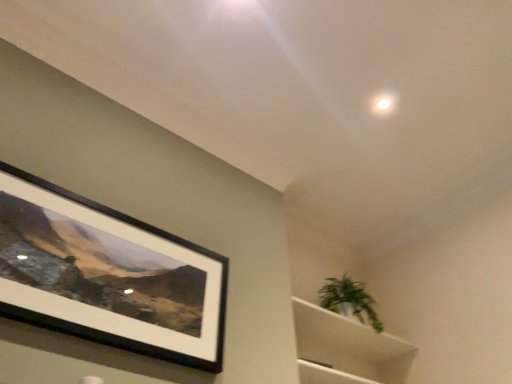
The height and width of the screenshot is (384, 512). What do you see at coordinates (346, 349) in the screenshot?
I see `white matte cabinet at lower right` at bounding box center [346, 349].

What is the approximate height of black matte picture frame at upper left?

The height of black matte picture frame at upper left is 20.05 inches.

What do you see at coordinates (106, 275) in the screenshot? Image resolution: width=512 pixels, height=384 pixels. I see `black matte picture frame at upper left` at bounding box center [106, 275].

Where is `green leafy plant at upper right`? This screenshot has height=384, width=512. green leafy plant at upper right is located at coordinates (349, 300).

From the image's perspective, which is above, green leafy plant at upper right or black matte picture frame at upper left?

From the image's view, black matte picture frame at upper left is above.

Between green leafy plant at upper right and black matte picture frame at upper left, which one has larger width?

green leafy plant at upper right is wider.

Find the location of a particular element. The image size is (512, 384). picture frame lying above the green leafy plant at upper right (from the image's perspective) is located at coordinates (106, 275).

Based on the photo, in terms of height, does black matte picture frame at upper left look taller or shorter compared to green leafy plant at upper right?

Considering their sizes, black matte picture frame at upper left has more height than green leafy plant at upper right.

Which point is more forward, (222, 287) or (354, 298)?

The point (222, 287) is closer.

From the image's perspective, who appears lower, black matte picture frame at upper left or green leafy plant at upper right?

green leafy plant at upper right is shown below in the image.

In the scene shown: Is black matte picture frame at upper left further to the viewer compared to green leafy plant at upper right?

No, the depth of black matte picture frame at upper left is less than that of green leafy plant at upper right.

From a real-world perspective, which is physically below, white matte cabinet at lower right or green leafy plant at upper right?

white matte cabinet at lower right is physically lower.

Is white matte cabinet at lower right not within green leafy plant at upper right?

Yes, white matte cabinet at lower right is located beyond the bounds of green leafy plant at upper right.

What's the angular difference between white matte cabinet at lower right and green leafy plant at upper right's facing directions?

They differ by 1.41 degrees in their facing directions.

Which object is thinner, white matte cabinet at lower right or green leafy plant at upper right?

With smaller width is green leafy plant at upper right.

Considering the sizes of objects black matte picture frame at upper left and white matte cabinet at lower right in the image provided, who is bigger, black matte picture frame at upper left or white matte cabinet at lower right?

With larger size is white matte cabinet at lower right.

Between black matte picture frame at upper left and white matte cabinet at lower right, which one is positioned behind?

white matte cabinet at lower right.

Identify the location of picture frame on the left side of white matte cabinet at lower right. (106, 275).

From the image's perspective, is green leafy plant at upper right above or below white matte cabinet at lower right?

green leafy plant at upper right is situated higher than white matte cabinet at lower right in the image.

Looking at this image, is green leafy plant at upper right positioned with its back to white matte cabinet at lower right?

No, green leafy plant at upper right is not facing away from white matte cabinet at lower right.

Based on their sizes in the image, would you say green leafy plant at upper right is bigger or smaller than white matte cabinet at lower right?

In the image, green leafy plant at upper right appears to be smaller than white matte cabinet at lower right.

Measure the distance from white matte cabinet at lower right to black matte picture frame at upper left.

A distance of 3.73 feet exists between white matte cabinet at lower right and black matte picture frame at upper left.

Does white matte cabinet at lower right lie in front of black matte picture frame at upper left?

That is False.

From the image's perspective, would you say white matte cabinet at lower right is positioned over black matte picture frame at upper left?

No, from the image's perspective, white matte cabinet at lower right is not over black matte picture frame at upper left.

Considering the relative sizes of white matte cabinet at lower right and black matte picture frame at upper left in the image provided, is white matte cabinet at lower right wider than black matte picture frame at upper left?

Yes.

This screenshot has width=512, height=384. In order to click on picture frame below the green leafy plant at upper right (from a real-world perspective) in this screenshot , I will do `click(106, 275)`.

Where is `picture frame above the green leafy plant at upper right (from the image's perspective)`? Image resolution: width=512 pixels, height=384 pixels. picture frame above the green leafy plant at upper right (from the image's perspective) is located at coordinates (106, 275).

Which object lies nearer to the anchor point black matte picture frame at upper left, green leafy plant at upper right or white matte cabinet at lower right?

white matte cabinet at lower right.

When comparing their distances from green leafy plant at upper right, does black matte picture frame at upper left or white matte cabinet at lower right seem further?

black matte picture frame at upper left is further to green leafy plant at upper right.

Looking at the image, which one is located further to green leafy plant at upper right, white matte cabinet at lower right or black matte picture frame at upper left?

Based on the image, black matte picture frame at upper left appears to be further to green leafy plant at upper right.

Based on their spatial positions, is white matte cabinet at lower right or green leafy plant at upper right further from black matte picture frame at upper left?

green leafy plant at upper right is positioned further to the anchor black matte picture frame at upper left.

When comparing their distances from white matte cabinet at lower right, does green leafy plant at upper right or black matte picture frame at upper left seem closer?

The object closer to white matte cabinet at lower right is green leafy plant at upper right.

Based on their spatial positions, is black matte picture frame at upper left or green leafy plant at upper right further from white matte cabinet at lower right?

black matte picture frame at upper left.

Where is `cabinet between black matte picture frame at upper left and green leafy plant at upper right in the horizontal direction`? The image size is (512, 384). cabinet between black matte picture frame at upper left and green leafy plant at upper right in the horizontal direction is located at coordinates (346, 349).